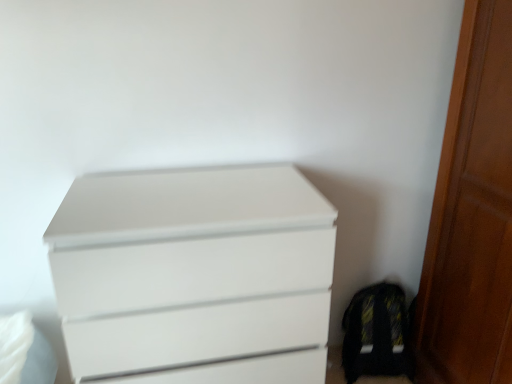
The height and width of the screenshot is (384, 512). I want to click on empty space that is ontop of white matte chest of drawers at lower left (from a real-world perspective), so click(x=199, y=193).